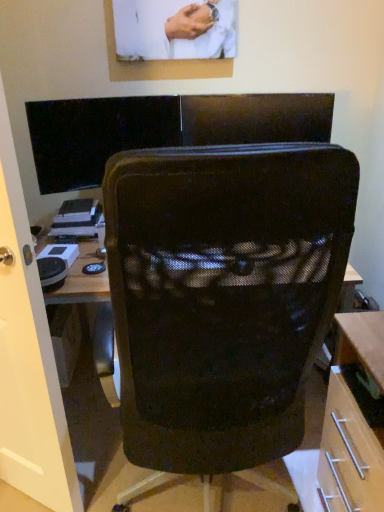
Question: Is transparent glass door at left spatially inside black mesh chair at center, or outside of it?

Choices:
 (A) outside
 (B) inside

Answer: (A)

Question: Relative to black mesh chair at center, is transparent glass door at left in front or behind?

Choices:
 (A) front
 (B) behind

Answer: (B)

Question: Which of these objects is positioned farthest from the black glossy monitor at upper left?

Choices:
 (A) transparent glass door at left
 (B) black mesh chair at center

Answer: (B)

Question: Which is nearer to the black mesh chair at center?

Choices:
 (A) black glossy monitor at upper left
 (B) transparent glass door at left

Answer: (B)